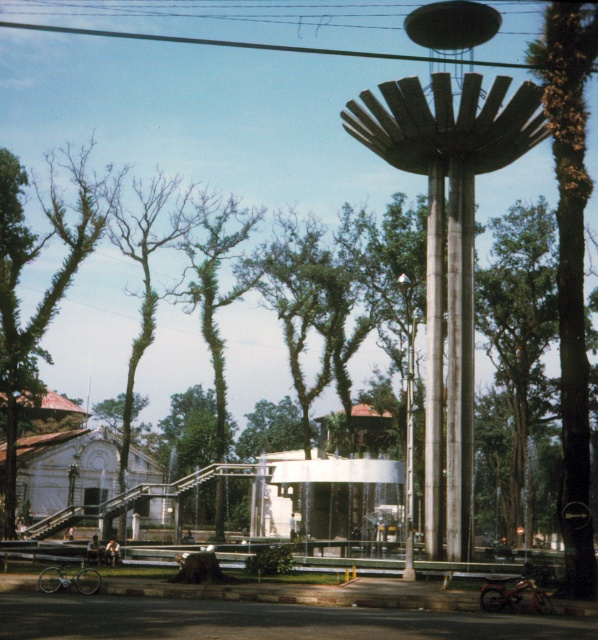
Question: Which object appears closest to the camera in this image?

Choices:
 (A) green leafy tree at left
 (B) metallic column at center

Answer: (B)

Question: Is green leafy tree at left below metallic column at center?

Choices:
 (A) no
 (B) yes

Answer: (A)

Question: Is metallic silver water tower at center right behind green leafy tree at right?

Choices:
 (A) no
 (B) yes

Answer: (B)

Question: From the image, what is the correct spatial relationship of green leafy tree at right in relation to metallic column at center?

Choices:
 (A) right
 (B) left

Answer: (A)

Question: Which point is closer to the camera?

Choices:
 (A) (572, 316)
 (B) (16, 275)

Answer: (A)

Question: Which object is positioned closest to the metallic silver water tower at center right?

Choices:
 (A) green leafy tree at left
 (B) metallic column at center
 (C) green leafy tree at right

Answer: (B)